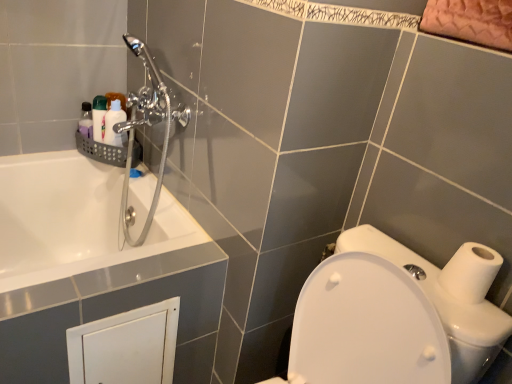
This screenshot has width=512, height=384. Identify the location of vacant area to the left of white matte toilet paper at right. (397, 281).